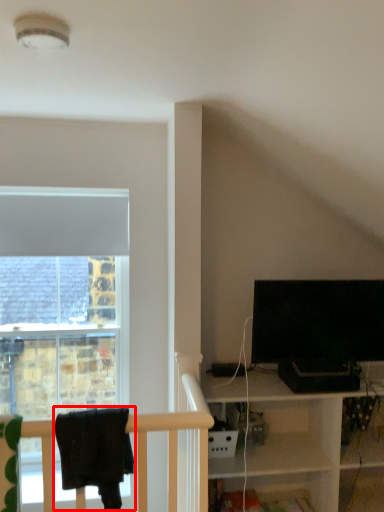
Question: From the image's perspective, where is laundry (annotated by the red box) located in relation to television in the image?

Choices:
 (A) below
 (B) above

Answer: (A)